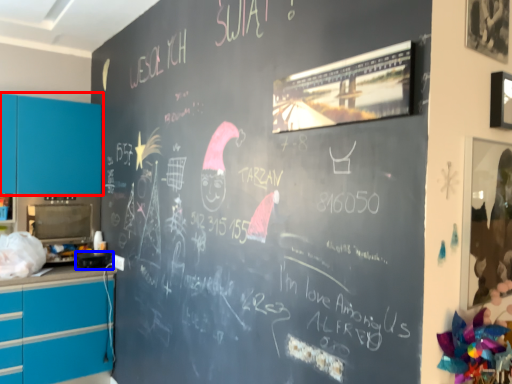
Question: Which of the following is the farthest to the observer, cabinetry (highlighted by a red box) or appliance (highlighted by a blue box)?

Choices:
 (A) cabinetry
 (B) appliance

Answer: (A)